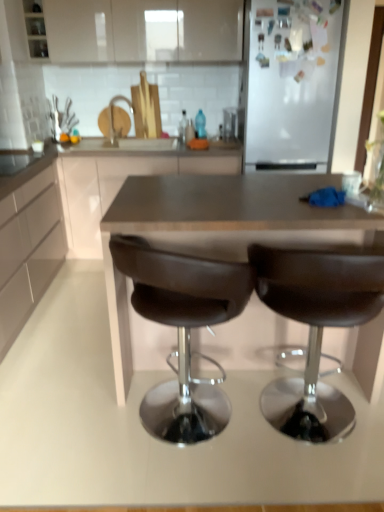
I want to click on free spot below brown leather chair at center, which is the second chair in right-to-left order (from a real-world perspective), so click(184, 435).